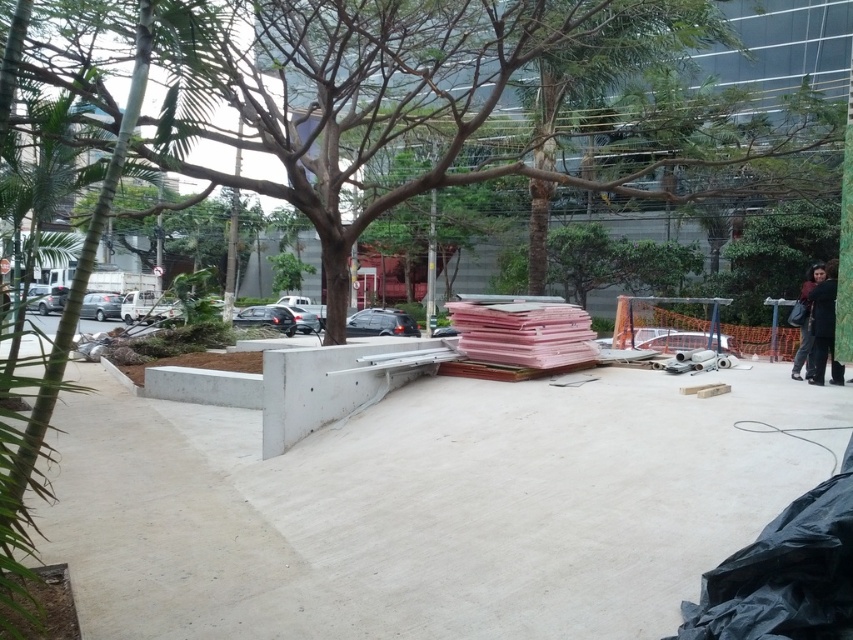
Who is positioned more to the left, black fabric at right or dark gray fabric at right?

black fabric at right is more to the left.

Is black fabric at right to the left of dark gray fabric at right from the viewer's perspective?

Yes, black fabric at right is to the left of dark gray fabric at right.

The image size is (853, 640). What do you see at coordinates (824, 326) in the screenshot?
I see `black fabric at right` at bounding box center [824, 326].

Locate an element on the screen. The width and height of the screenshot is (853, 640). black fabric at right is located at coordinates (824, 326).

From the picture: Does white smooth concrete at center appear over black fabric at right?

Incorrect, white smooth concrete at center is not positioned above black fabric at right.

What do you see at coordinates (426, 508) in the screenshot?
I see `white smooth concrete at center` at bounding box center [426, 508].

Is point (788, 492) closer to camera compared to point (824, 340)?

Yes, it is.

The width and height of the screenshot is (853, 640). Identify the location of white smooth concrete at center. (426, 508).

Is white smooth concrete at center closer to camera compared to dark gray fabric at right?

Yes, it is in front of dark gray fabric at right.

Does white smooth concrete at center appear under dark gray fabric at right?

Yes, white smooth concrete at center is below dark gray fabric at right.

Which is behind, point (604, 566) or point (802, 340)?

The point (802, 340) is more distant.

I want to click on white smooth concrete at center, so click(426, 508).